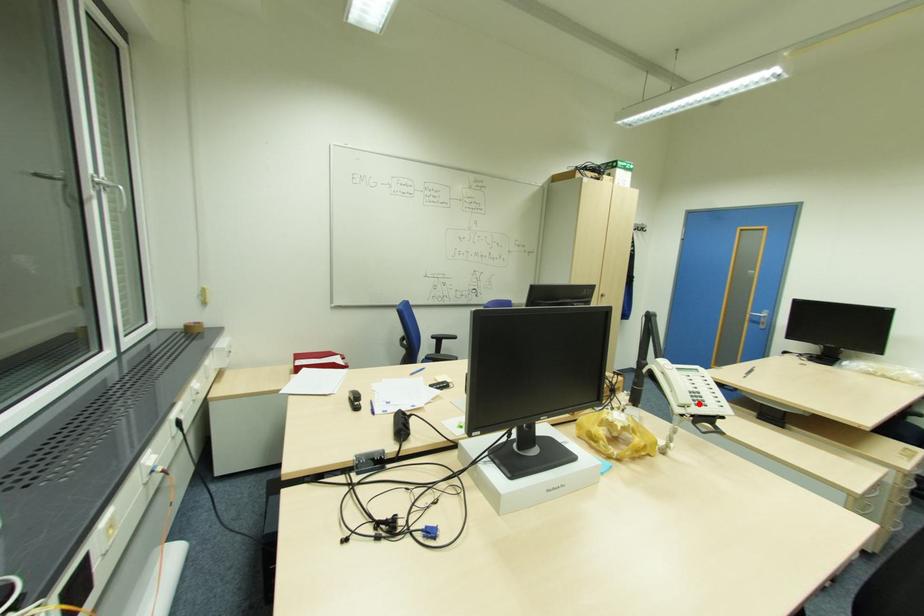
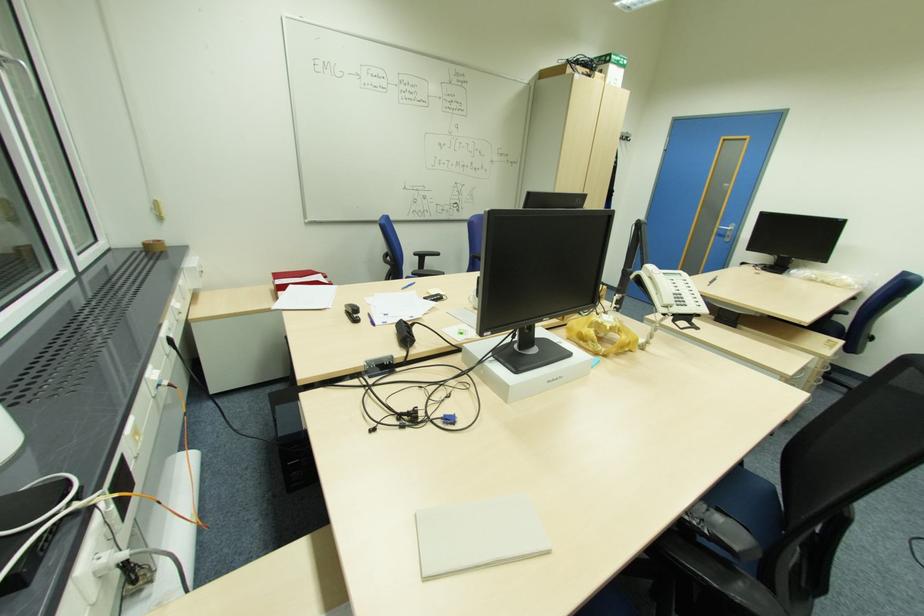
Question: I am providing you with two images of the same scene from different viewpoints. A red point is marked on the first image. Can you still see the location of the red point in image 2?

Choices:
 (A) Yes
 (B) No

Answer: (A)